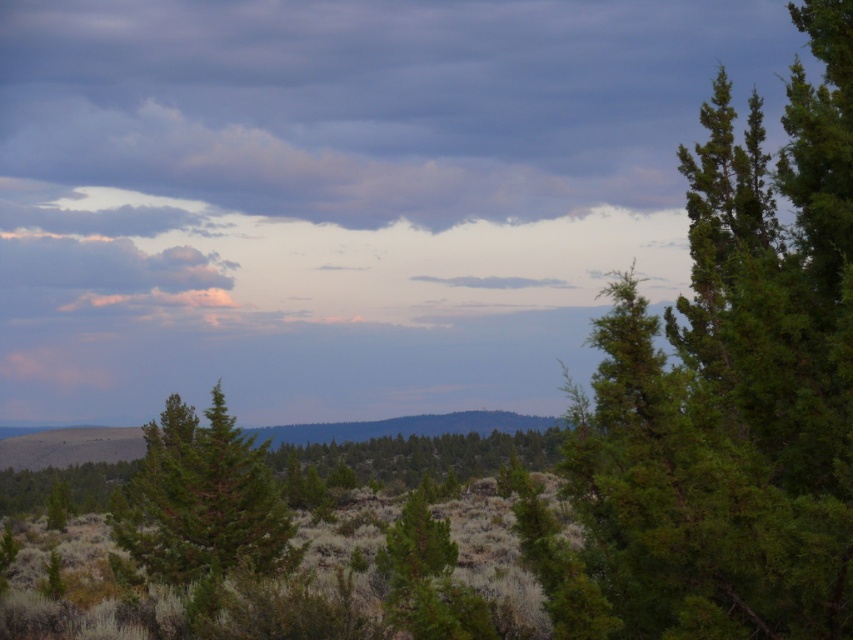
You are an artist planning to paint the scene. You have two canvas sections left. One is for the green textured tree at right and the other for the cloudy sky at upper center. Which area will require more detailed work considering their size?

The cloudy sky at upper center requires more detailed work because it occupies more space than the green textured tree at right.

Consider the image. You are planning to paint the scene and want to ensure the green textured tree at center and the pink fluffy cloud at upper left are proportionally accurate. Which object should you make wider in your painting to maintain the correct size relationship?

The pink fluffy cloud at upper left should be made wider in the painting because the green textured tree at center is narrower than the pink fluffy cloud at upper left according to the description.

You are standing in the serene landscape scene. There is a point at coordinates [735,387]. What object is located at this point?

The point at coordinates [735,387] corresponds to the green textured tree at right.